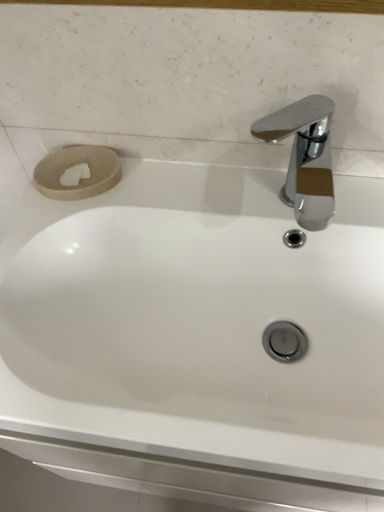
Question: Is beige matte toilet paper at upper left to the left or to the right of chrome/metallic faucet at upper right in the image?

Choices:
 (A) right
 (B) left

Answer: (B)

Question: Based on their sizes in the image, would you say beige matte toilet paper at upper left is bigger or smaller than chrome/metallic faucet at upper right?

Choices:
 (A) small
 (B) big

Answer: (A)

Question: Choose the correct answer: Is beige matte toilet paper at upper left inside chrome/metallic faucet at upper right or outside it?

Choices:
 (A) inside
 (B) outside

Answer: (B)

Question: Is chrome/metallic faucet at upper right situated inside beige matte toilet paper at upper left or outside?

Choices:
 (A) outside
 (B) inside

Answer: (A)

Question: Considering the positions of chrome/metallic faucet at upper right and beige matte toilet paper at upper left in the image, is chrome/metallic faucet at upper right taller or shorter than beige matte toilet paper at upper left?

Choices:
 (A) tall
 (B) short

Answer: (A)

Question: Is chrome/metallic faucet at upper right wider or thinner than beige matte toilet paper at upper left?

Choices:
 (A) thin
 (B) wide

Answer: (B)

Question: Based on their sizes in the image, would you say chrome/metallic faucet at upper right is bigger or smaller than beige matte toilet paper at upper left?

Choices:
 (A) big
 (B) small

Answer: (A)